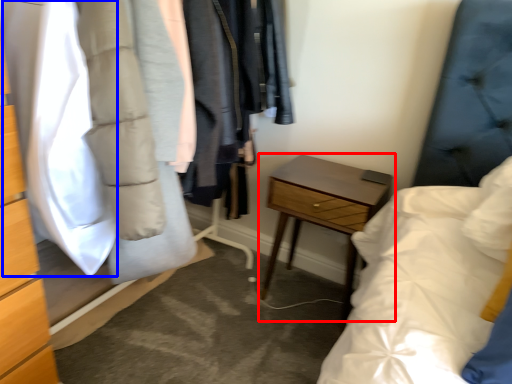
Question: Which object is further to the camera taking this photo, nightstand (highlighted by a red box) or clothing (highlighted by a blue box)?

Choices:
 (A) nightstand
 (B) clothing

Answer: (A)